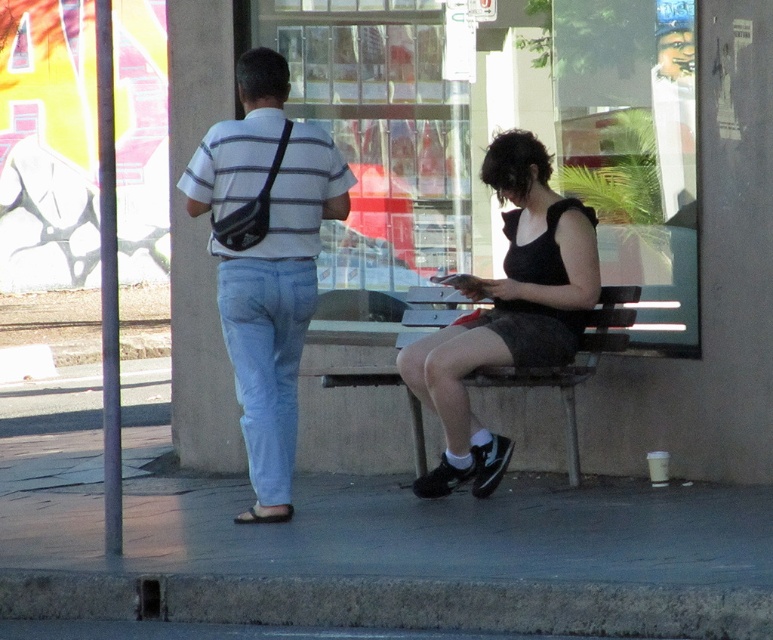
Does matte black sneakers at lower center have a greater height compared to wooden bench at center?

Yes, matte black sneakers at lower center is taller than wooden bench at center.

Can you confirm if matte black sneakers at lower center is wider than wooden bench at center?

Yes.

Who is more distant from viewer, (545, 154) or (567, 374)?

The point (545, 154) is behind.

Where is `matte black sneakers at lower center`? matte black sneakers at lower center is located at coordinates (465, 392).

Can you confirm if striped cotton shirt at center is positioned to the right of black fabric dress at center?

No, striped cotton shirt at center is not to the right of black fabric dress at center.

Does striped cotton shirt at center lie behind black fabric dress at center?

That is False.

Describe the element at coordinates (278, 310) in the screenshot. I see `striped cotton shirt at center` at that location.

Locate an element on the screen. striped cotton shirt at center is located at coordinates (278, 310).

How distant is striped cotton shirt at center from light blue denim jeans at center?

They are 4.37 inches apart.

Is striped cotton shirt at center behind light blue denim jeans at center?

That is False.

Is point (301, 337) closer to viewer compared to point (240, 284)?

No, it is not.

Where is `striped cotton shirt at center`? striped cotton shirt at center is located at coordinates (278, 310).